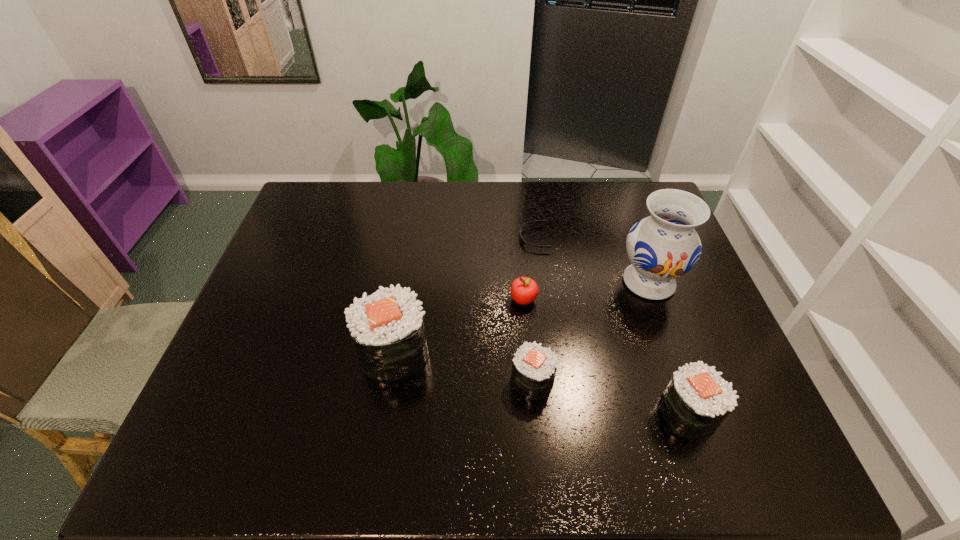
Locate an element on the screen. This screenshot has width=960, height=540. blank space at the far edge of the desktop is located at coordinates (607, 207).

Where is `free spot at the near edge of the desktop`? free spot at the near edge of the desktop is located at coordinates (586, 407).

In the image, there is a desktop. Where is `vacant space at the left edge`? vacant space at the left edge is located at coordinates (327, 254).

Find the location of `vacant space at the far left corner of the desktop`. vacant space at the far left corner of the desktop is located at coordinates (332, 190).

Identify the location of unoccupied position between the leftmost sushi and the shortest sushi. (463, 366).

At what (x,y) coordinates should I click in order to perform the action: click on empty space between the apple and the tallest object. Please return your answer as a coordinate pair (x, y). Image resolution: width=960 pixels, height=540 pixels. Looking at the image, I should click on (587, 291).

The width and height of the screenshot is (960, 540). I want to click on vacant space that is in between the second shortest sushi and the apple, so click(606, 356).

Where is `vacant space that is in between the leftmost sushi and the shortest object`? Image resolution: width=960 pixels, height=540 pixels. vacant space that is in between the leftmost sushi and the shortest object is located at coordinates (464, 295).

Image resolution: width=960 pixels, height=540 pixels. In order to click on free area in between the leftmost object and the shortest object in this screenshot , I will do `click(464, 295)`.

Where is `empty space that is in between the apple and the leftmost sushi`? empty space that is in between the apple and the leftmost sushi is located at coordinates (459, 326).